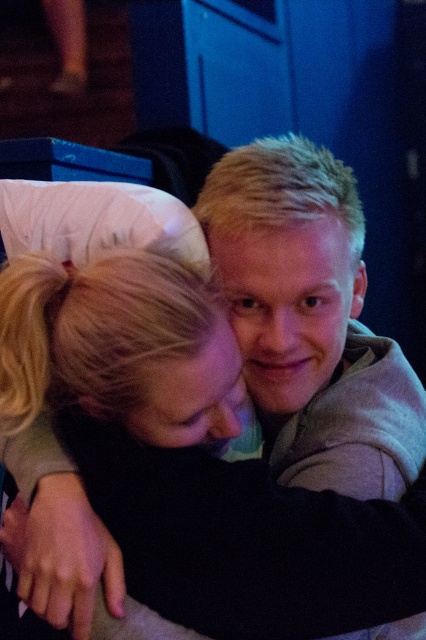
You are a photographer adjusting the lighting for a portrait. You notice the gray fleece hoodie at center and the black soft fabric at center in your frame. Which object should you focus on to ensure proper exposure, considering their size in the image?

The gray fleece hoodie at center is much taller than the black soft fabric at center, so focusing on the gray fleece hoodie at center would ensure proper exposure due to its larger size in the frame.

You are a photographer adjusting the lighting for a portrait. You notice the gray fleece hoodie at center and the black soft fabric at center in your frame. Which object should you focus on first if you want to highlight the subject wearing the hoodie?

The gray fleece hoodie at center is located above the black soft fabric at center, so focusing on the gray fleece hoodie at center first will ensure the subject wearing it is highlighted properly.

You are a photographer trying to focus on the gray fleece hoodie at center. What coordinates should you aim your camera at to capture it perfectly?

You should aim your camera at the coordinates point (310, 321) to capture the gray fleece hoodie at center.